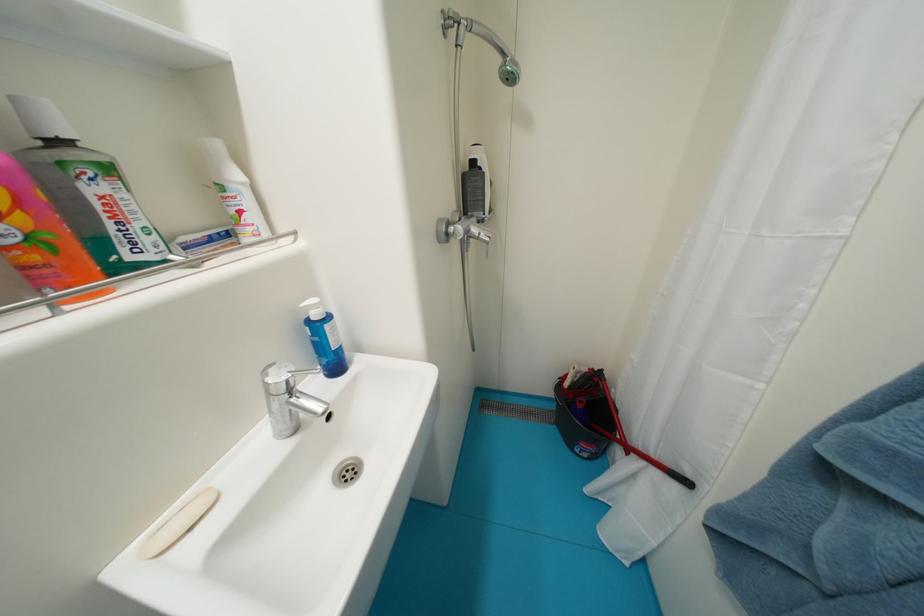
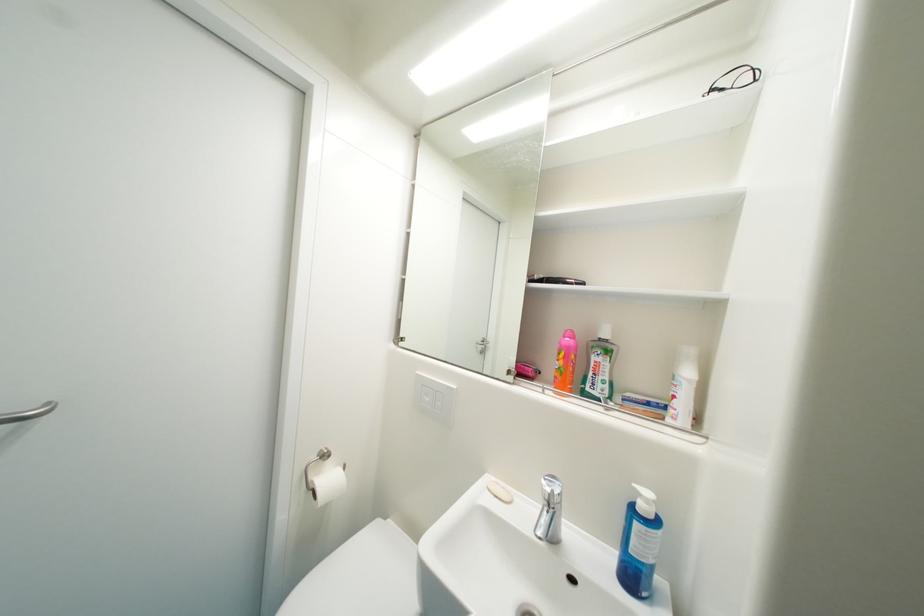
Locate, in the second image, the point that corresponds to the point at 314,323 in the first image.

(641, 507)